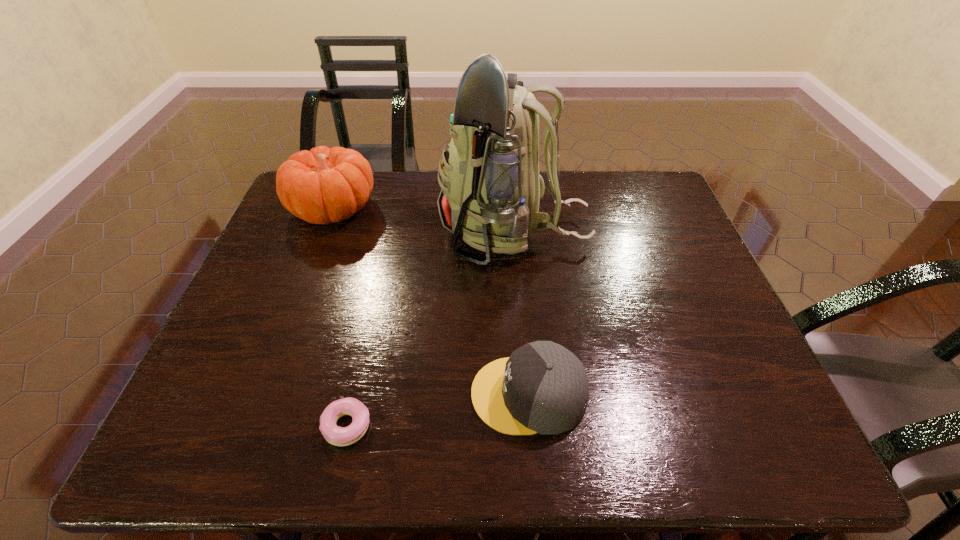
Where is `the tallest object`? the tallest object is located at coordinates (490, 184).

Find the location of a particular element. The image size is (960, 540). pumpkin is located at coordinates (323, 185).

Where is `the third shortest object`? The height and width of the screenshot is (540, 960). the third shortest object is located at coordinates (323, 185).

The image size is (960, 540). Find the location of `the second shortest object`. the second shortest object is located at coordinates (543, 388).

At what (x,y) coordinates should I click in order to perform the action: click on the shortest object. Please return your answer as a coordinate pair (x, y). This screenshot has height=540, width=960. Looking at the image, I should click on (339, 436).

Where is `doughnut`? The width and height of the screenshot is (960, 540). doughnut is located at coordinates (339, 436).

The height and width of the screenshot is (540, 960). Find the location of `vacant space situated on the front-facing side of the tallest object`. vacant space situated on the front-facing side of the tallest object is located at coordinates (350, 231).

At what (x,y) coordinates should I click in order to perform the action: click on free space located 0.260m on the front-facing side of the tallest object. Please return your answer as a coordinate pair (x, y). This screenshot has width=960, height=540. Looking at the image, I should click on (350, 231).

At what (x,y) coordinates should I click in order to perform the action: click on vacant area situated 0.100m on the front-facing side of the tallest object. Please return your answer as a coordinate pair (x, y). Image resolution: width=960 pixels, height=540 pixels. Looking at the image, I should click on click(x=406, y=231).

What are the coordinates of `vacant space located on the front of the second tallest object` in the screenshot? It's located at (316, 255).